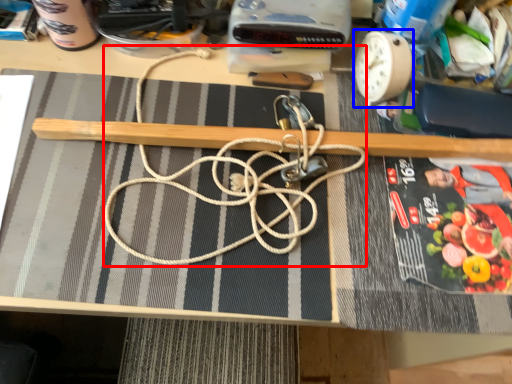
Question: Which of the following is the closest to the observer, string (highlighted by a red box) or clock (highlighted by a blue box)?

Choices:
 (A) string
 (B) clock

Answer: (A)